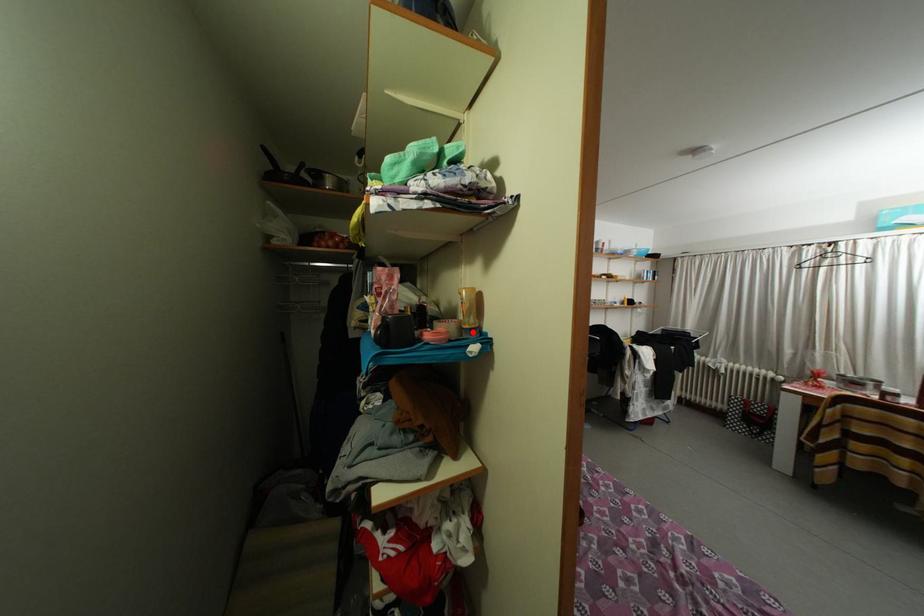
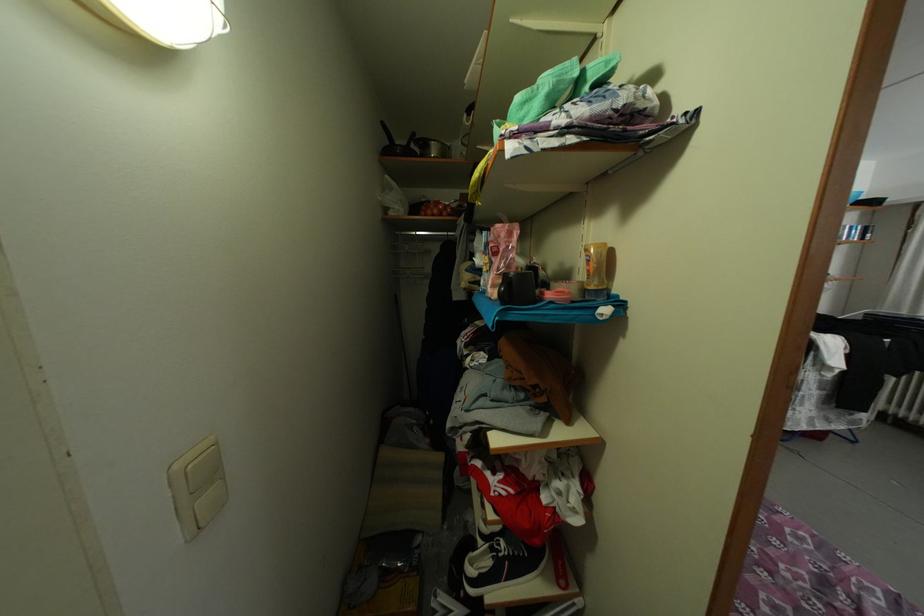
The point at the highlighted location is marked in the first image. Where is the corresponding point in the second image?

(598, 293)